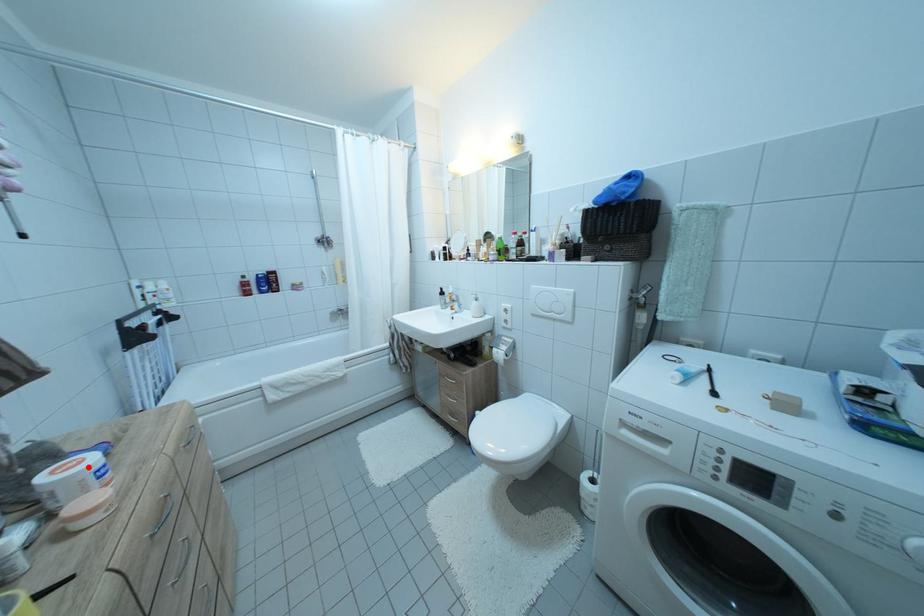
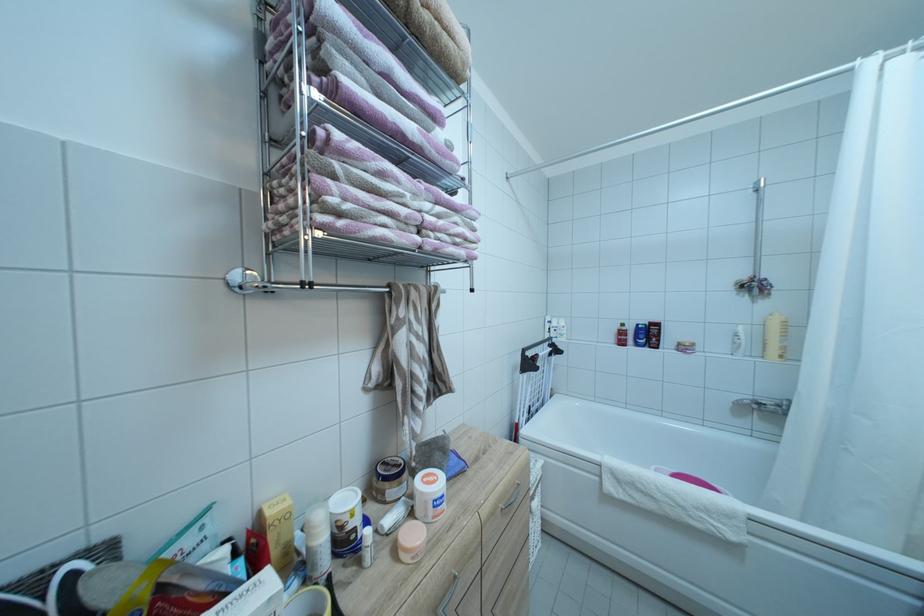
Where in the second image is the point corresponding to the highlighted location from the first image?

(442, 487)